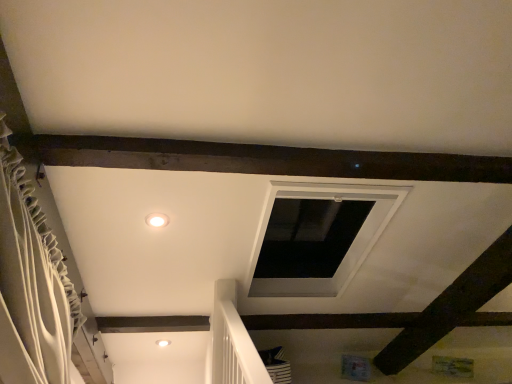
Measure the distance between point (150, 216) and camera.

Point (150, 216) is 1.67 meters from camera.

Where is `matte white light fixture at center`? The height and width of the screenshot is (384, 512). matte white light fixture at center is located at coordinates (157, 220).

What is the approximate height of matte white light fixture at center?

It is 3.88 inches.

What do you see at coordinates (157, 220) in the screenshot? Image resolution: width=512 pixels, height=384 pixels. I see `matte white light fixture at center` at bounding box center [157, 220].

Image resolution: width=512 pixels, height=384 pixels. What do you see at coordinates (31, 283) in the screenshot?
I see `white textured curtain at left` at bounding box center [31, 283].

You are a GUI agent. You are given a task and a screenshot of the screen. Output one action in this format:
    pyautogui.click(x=<x>, y=<y>)
    Task: Click on the white textured curtain at left
    The width and height of the screenshot is (512, 384).
    Given the screenshot: What is the action you would take?
    pyautogui.click(x=31, y=283)

Where is `matte white light fixture at center`? This screenshot has height=384, width=512. matte white light fixture at center is located at coordinates (157, 220).

Does matte white light fixture at center appear on the left side of white textured curtain at left?

In fact, matte white light fixture at center is to the right of white textured curtain at left.

Does matte white light fixture at center lie behind white textured curtain at left?

Yes.

Which is closer to the camera, (153, 222) or (42, 292)?

Point (153, 222) is farther from the camera than point (42, 292).

From the image's perspective, is matte white light fixture at center below white textured curtain at left?

No, from the image's perspective, matte white light fixture at center is not beneath white textured curtain at left.

From a real-world perspective, relative to white textured curtain at left, is matte white light fixture at center vertically above or below?

In terms of real-world spatial position, matte white light fixture at center is above white textured curtain at left.

Which object is thinner, matte white light fixture at center or white textured curtain at left?

Thinner between the two is matte white light fixture at center.

From the picture: Can you confirm if matte white light fixture at center is shorter than white textured curtain at left?

Yes.

Is matte white light fixture at center bigger than white textured curtain at left?

No, matte white light fixture at center is not bigger than white textured curtain at left.

Would you say matte white light fixture at center contains white textured curtain at left?

No, matte white light fixture at center does not contain white textured curtain at left.

Is there a large distance between matte white light fixture at center and white textured curtain at left?

No, matte white light fixture at center is in close proximity to white textured curtain at left.

Does matte white light fixture at center turn towards white textured curtain at left?

No, matte white light fixture at center is not facing towards white textured curtain at left.

How different are the orientations of matte white light fixture at center and white textured curtain at left in degrees?

The facing directions of matte white light fixture at center and white textured curtain at left are 165 degrees apart.

Where is `lighting positioned vertically above the white textured curtain at left (from a real-world perspective)`? Image resolution: width=512 pixels, height=384 pixels. lighting positioned vertically above the white textured curtain at left (from a real-world perspective) is located at coordinates [157, 220].

Based on the photo, considering the relative positions of white textured curtain at left and matte white light fixture at center in the image provided, is white textured curtain at left to the left of matte white light fixture at center from the viewer's perspective?

Indeed, white textured curtain at left is positioned on the left side of matte white light fixture at center.

In the scene shown: Is the position of white textured curtain at left more distant than that of matte white light fixture at center?

No, it is in front of matte white light fixture at center.

Does point (10, 133) come farther from viewer compared to point (154, 222)?

No, (10, 133) is in front of (154, 222).

From the image's perspective, between white textured curtain at left and matte white light fixture at center, who is located below?

white textured curtain at left is shown below in the image.

From a real-world perspective, is white textured curtain at left beneath matte white light fixture at center?

Yes, from a real-world perspective, white textured curtain at left is beneath matte white light fixture at center.

Considering the sizes of white textured curtain at left and matte white light fixture at center in the image, is white textured curtain at left wider or thinner than matte white light fixture at center?

In the image, white textured curtain at left appears to be wider than matte white light fixture at center.

Who is taller, white textured curtain at left or matte white light fixture at center?

white textured curtain at left is taller.

Who is smaller, white textured curtain at left or matte white light fixture at center?

matte white light fixture at center.

Is white textured curtain at left inside the boundaries of matte white light fixture at center, or outside?

white textured curtain at left is outside matte white light fixture at center.

Is white textured curtain at left with matte white light fixture at center?

They are not placed beside each other.

Could you tell me if white textured curtain at left is turned towards matte white light fixture at center?

No, white textured curtain at left is not facing towards matte white light fixture at center.

Where is `curtain that appears on the left of matte white light fixture at center`? Image resolution: width=512 pixels, height=384 pixels. curtain that appears on the left of matte white light fixture at center is located at coordinates (31, 283).

In order to click on lighting that appears behind the white textured curtain at left in this screenshot , I will do `click(157, 220)`.

Where is `lighting that is above the white textured curtain at left (from the image's perspective)`? The image size is (512, 384). lighting that is above the white textured curtain at left (from the image's perspective) is located at coordinates [x=157, y=220].